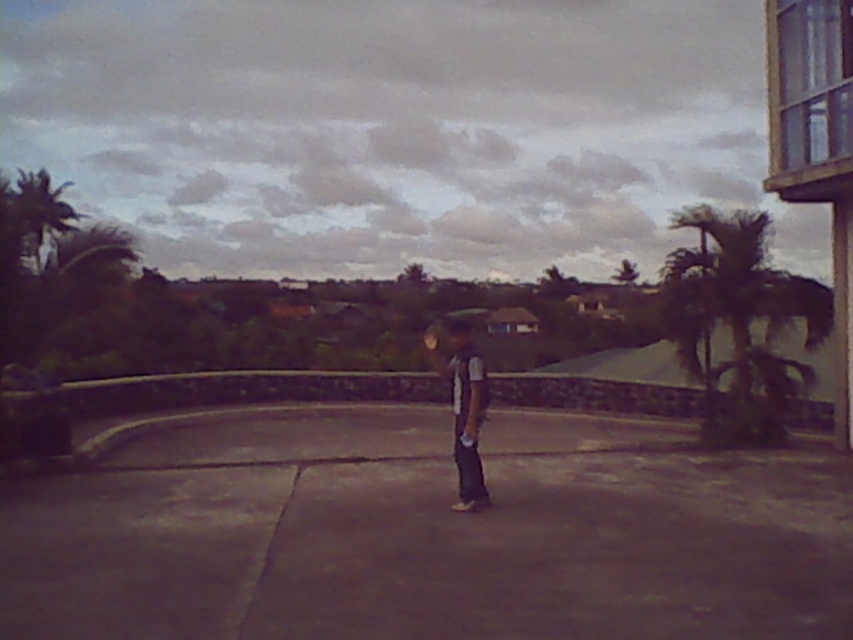
Question: Which object is positioned farthest from the green leafy palm tree at right?

Choices:
 (A) dark gray jeans at center
 (B) green leafy palm tree at upper left

Answer: (B)

Question: Which point is closer to the camera?

Choices:
 (A) dark gray jeans at center
 (B) green leafy palm tree at right

Answer: (A)

Question: Does green leafy palm tree at right come behind dark gray jeans at center?

Choices:
 (A) yes
 (B) no

Answer: (A)

Question: Which point appears closest to the camera in this image?

Choices:
 (A) (730, 282)
 (B) (469, 385)
 (C) (61, 232)

Answer: (B)

Question: Can you confirm if green leafy palm tree at right is positioned above green leafy palm tree at upper left?

Choices:
 (A) yes
 (B) no

Answer: (B)

Question: Does dark gray jeans at center have a lesser width compared to green leafy palm tree at upper left?

Choices:
 (A) yes
 (B) no

Answer: (A)